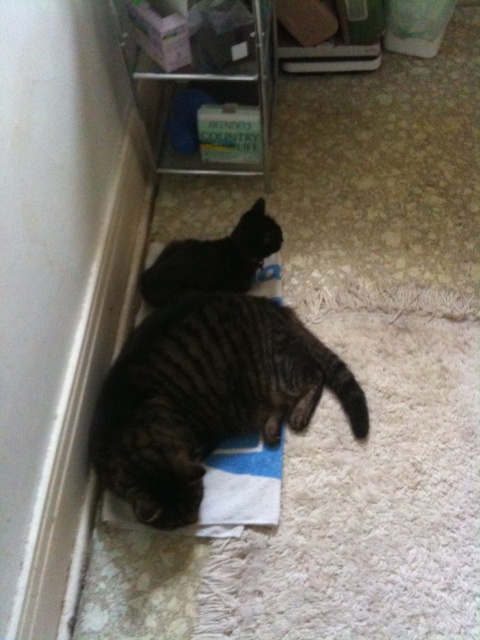
Question: Which object is closer to the camera taking this photo?

Choices:
 (A) striped fur cat at lower left
 (B) black fur cat at center

Answer: (A)

Question: Among these objects, which one is farthest from the camera?

Choices:
 (A) striped fur cat at lower left
 (B) black fur cat at center

Answer: (B)

Question: Does striped fur cat at lower left appear on the right side of black fur cat at center?

Choices:
 (A) no
 (B) yes

Answer: (A)

Question: Does striped fur cat at lower left appear under black fur cat at center?

Choices:
 (A) yes
 (B) no

Answer: (A)

Question: Is striped fur cat at lower left to the right of black fur cat at center from the viewer's perspective?

Choices:
 (A) yes
 (B) no

Answer: (B)